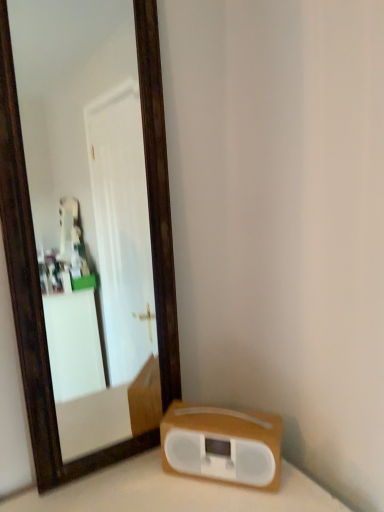
In order to face white plastic stereo at lower right, should I rotate leftwards or rightwards?

You should rotate right by 3.877 degrees.

Describe the element at coordinates (222, 444) in the screenshot. I see `white plastic stereo at lower right` at that location.

Identify the location of white plastic stereo at lower right. The height and width of the screenshot is (512, 384). (222, 444).

I want to click on white plastic stereo at lower right, so click(x=222, y=444).